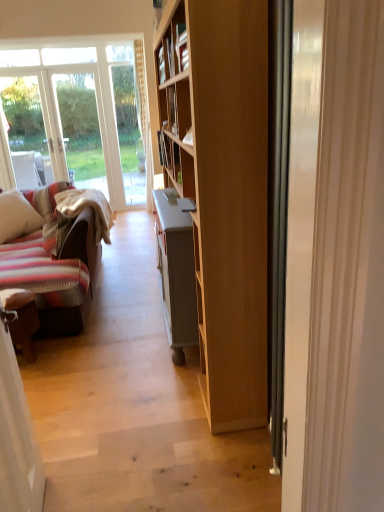
Question: Is white glossy door at right facing towards striped fabric pillow at left?

Choices:
 (A) yes
 (B) no

Answer: (B)

Question: Does white glossy door at right have a smaller size compared to striped fabric pillow at left?

Choices:
 (A) no
 (B) yes

Answer: (B)

Question: Can we say white glossy door at right lies outside striped fabric pillow at left?

Choices:
 (A) no
 (B) yes

Answer: (B)

Question: From a real-world perspective, is white glossy door at right physically below striped fabric pillow at left?

Choices:
 (A) no
 (B) yes

Answer: (A)

Question: Is white glossy door at right wider than striped fabric pillow at left?

Choices:
 (A) yes
 (B) no

Answer: (B)

Question: Is white glossy door at right positioned with its back to striped fabric pillow at left?

Choices:
 (A) no
 (B) yes

Answer: (A)

Question: Does striped fabric pillow at left have a lesser width compared to white glossy door at right?

Choices:
 (A) no
 (B) yes

Answer: (A)

Question: Can you confirm if striped fabric pillow at left is shorter than white glossy door at right?

Choices:
 (A) yes
 (B) no

Answer: (A)

Question: From the image's perspective, does striped fabric pillow at left appear lower than white glossy door at right?

Choices:
 (A) yes
 (B) no

Answer: (B)

Question: Can you confirm if striped fabric pillow at left is taller than white glossy door at right?

Choices:
 (A) no
 (B) yes

Answer: (A)

Question: From a real-world perspective, is striped fabric pillow at left over white glossy door at right?

Choices:
 (A) no
 (B) yes

Answer: (A)

Question: Is striped fabric pillow at left further to the viewer compared to white glossy door at right?

Choices:
 (A) yes
 (B) no

Answer: (A)

Question: Does striped fabric pillow at left lie behind brown leather chair at lower left?

Choices:
 (A) no
 (B) yes

Answer: (B)